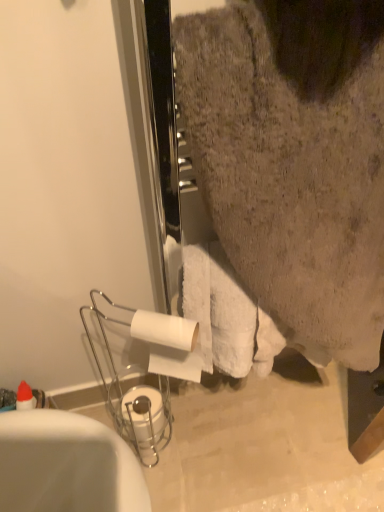
Question: Which direction should I rotate to look at white matte toilet paper at center, which is counted as the 2th toilet paper, starting from the back, — up or down?

Choices:
 (A) down
 (B) up

Answer: (A)

Question: Can you confirm if white matte toilet paper at center, which is counted as the 2th toilet paper, starting from the back, is bigger than white matte toilet paper at lower center, which ranks as the second toilet paper in top-to-bottom order?

Choices:
 (A) no
 (B) yes

Answer: (B)

Question: Can you confirm if white matte toilet paper at center, the first toilet paper when ordered from front to back, is taller than white matte toilet paper at lower center, which appears as the second toilet paper when viewed from the front?

Choices:
 (A) no
 (B) yes

Answer: (B)

Question: Is white matte toilet paper at center, which is counted as the 2th toilet paper, starting from the back, in front of white matte toilet paper at lower center, which appears as the second toilet paper when viewed from the front?

Choices:
 (A) yes
 (B) no

Answer: (A)

Question: From the image's perspective, does white matte toilet paper at center, which is counted as the second toilet paper, starting from the bottom, appear lower than white matte toilet paper at lower center, arranged as the 1th toilet paper when ordered from the bottom?

Choices:
 (A) no
 (B) yes

Answer: (A)

Question: Is white matte toilet paper at center, the first toilet paper when ordered from front to back, far away from white matte toilet paper at lower center, arranged as the 1th toilet paper when ordered from the bottom?

Choices:
 (A) no
 (B) yes

Answer: (A)

Question: Is white matte toilet paper at lower center, marked as the first toilet paper in a back-to-front arrangement, at the back of white matte toilet paper at center, which is counted as the second toilet paper, starting from the bottom?

Choices:
 (A) yes
 (B) no

Answer: (B)

Question: Considering the relative sizes of white glossy bathtub at lower left and white matte toilet paper at lower center, which ranks as the second toilet paper in top-to-bottom order, in the image provided, is white glossy bathtub at lower left taller than white matte toilet paper at lower center, which ranks as the second toilet paper in top-to-bottom order,?

Choices:
 (A) no
 (B) yes

Answer: (B)

Question: Is white glossy bathtub at lower left bigger than white matte toilet paper at lower center, which appears as the second toilet paper when viewed from the front?

Choices:
 (A) no
 (B) yes

Answer: (B)

Question: From a real-world perspective, does white glossy bathtub at lower left stand above white matte toilet paper at lower center, which ranks as the second toilet paper in top-to-bottom order?

Choices:
 (A) no
 (B) yes

Answer: (B)

Question: Is white glossy bathtub at lower left not within white matte toilet paper at lower center, which ranks as the second toilet paper in top-to-bottom order?

Choices:
 (A) no
 (B) yes

Answer: (B)

Question: Considering the relative sizes of white glossy bathtub at lower left and white matte toilet paper at lower center, arranged as the 1th toilet paper when ordered from the bottom, in the image provided, is white glossy bathtub at lower left shorter than white matte toilet paper at lower center, arranged as the 1th toilet paper when ordered from the bottom,?

Choices:
 (A) no
 (B) yes

Answer: (A)

Question: Are white glossy bathtub at lower left and white matte toilet paper at lower center, arranged as the 1th toilet paper when ordered from the bottom, beside each other?

Choices:
 (A) no
 (B) yes

Answer: (A)

Question: Is white matte toilet paper at lower center, arranged as the 1th toilet paper when ordered from the bottom, bigger than white glossy bathtub at lower left?

Choices:
 (A) yes
 (B) no

Answer: (B)